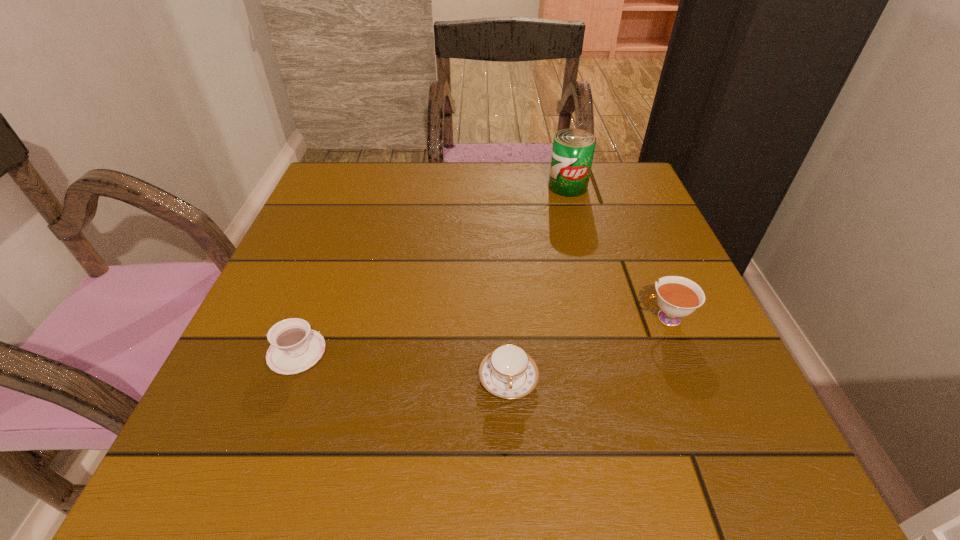
This screenshot has width=960, height=540. Find the location of `vacant region located 0.060m on the side with the handle of the second teacup from left to right`. vacant region located 0.060m on the side with the handle of the second teacup from left to right is located at coordinates (512, 443).

The image size is (960, 540). I want to click on blank area located on the handle side of the leftmost teacup, so click(238, 352).

Image resolution: width=960 pixels, height=540 pixels. Find the location of `object positioned at the far edge`. object positioned at the far edge is located at coordinates (573, 149).

The height and width of the screenshot is (540, 960). In order to click on object that is at the left edge in this screenshot , I will do `click(295, 347)`.

This screenshot has width=960, height=540. Identify the location of can located at the right edge. (573, 149).

What are the coordinates of `teacup that is positioned at the right edge` in the screenshot? It's located at (677, 297).

Identify the location of object positioned at the far right corner. (573, 149).

In the image, there is a desktop. Identify the location of vacant region at the far edge. (461, 171).

Find the location of a particular element. The height and width of the screenshot is (540, 960). free region at the near edge of the desktop is located at coordinates (505, 487).

Image resolution: width=960 pixels, height=540 pixels. What are the coordinates of `free spot at the left edge of the desktop` in the screenshot? It's located at (339, 254).